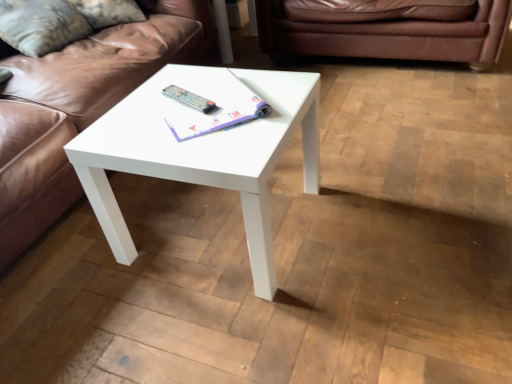
Find the location of `blank area beneath white glossy coffee table at center (from a real-world perspective)`. blank area beneath white glossy coffee table at center (from a real-world perspective) is located at coordinates 209,227.